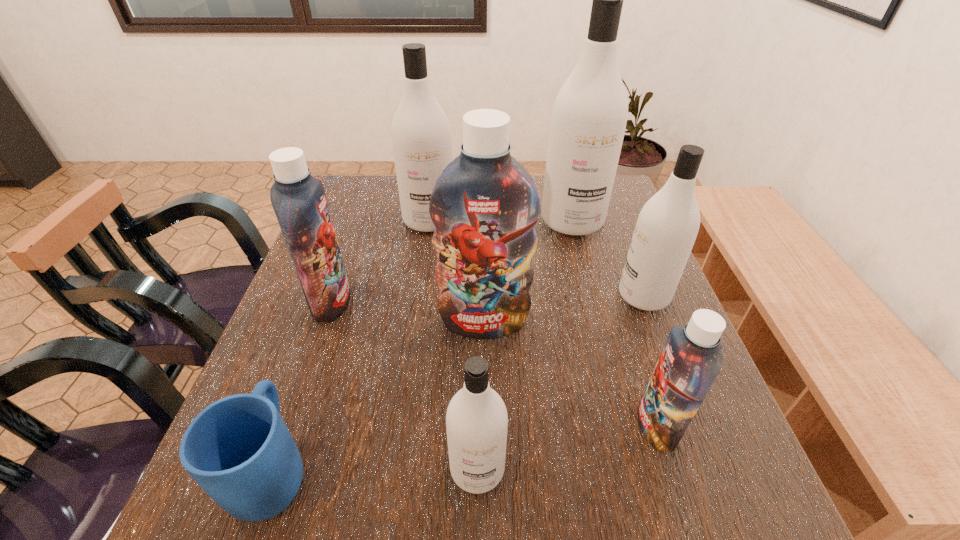
Find the location of `the nearest white shampoo`. the nearest white shampoo is located at coordinates (476, 420).

Locate an element on the screen. This screenshot has height=540, width=960. the shortest object is located at coordinates point(238,449).

The height and width of the screenshot is (540, 960). Find the location of `blue mug`. blue mug is located at coordinates (238, 449).

At what (x,y) coordinates should I click in order to perform the action: click on vacant point located on the front-facing side of the biggest white shampoo. Please return your answer as a coordinate pair (x, y). Looking at the image, I should click on (591, 293).

Locate an element on the screen. free space located on the front-facing side of the second biggest white shampoo is located at coordinates (412, 340).

Locate an element on the screen. The height and width of the screenshot is (540, 960). vacant space located on the front label of the biggest blue shampoo is located at coordinates (486, 532).

At what (x,y) coordinates should I click in order to perform the action: click on free space located on the front label of the leftmost blue shampoo. Please return your answer as a coordinate pair (x, y). The image size is (960, 540). Looking at the image, I should click on (448, 301).

You are a GUI agent. You are given a task and a screenshot of the screen. Output one action in this format:
    pyautogui.click(x=<x>, y=<y>)
    Task: Click on the free space located on the front-facing side of the third biggest white shampoo
    
    Given the screenshot: What is the action you would take?
    pyautogui.click(x=540, y=296)

At what (x,y) coordinates should I click in order to perform the action: click on free space located on the front-facing side of the third biggest white shampoo. Please return your answer as a coordinate pair (x, y). The image size is (960, 540). Looking at the image, I should click on pyautogui.click(x=513, y=296).

I want to click on vacant area situated 0.250m on the front-facing side of the third biggest white shampoo, so click(x=509, y=296).